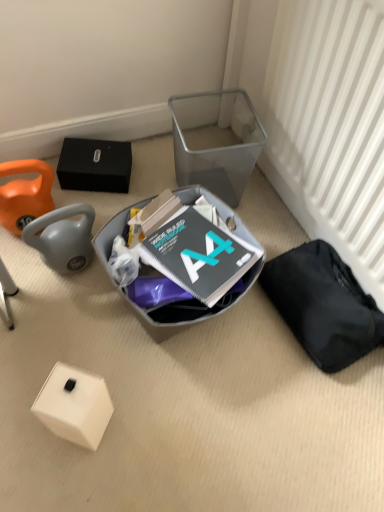
Question: From a real-world perspective, is white matte box at lower left above or below matte gray plastic bin at center, marked as the 1th waste in a left-to-right arrangement?

Choices:
 (A) below
 (B) above

Answer: (A)

Question: Considering the positions of white matte box at lower left and matte gray plastic bin at center, marked as the 1th waste in a left-to-right arrangement, in the image, is white matte box at lower left bigger or smaller than matte gray plastic bin at center, marked as the 1th waste in a left-to-right arrangement,?

Choices:
 (A) big
 (B) small

Answer: (B)

Question: Considering the real-world distances, which object is closest to the matte gray plastic bin at center, which appears as the second waste when viewed from the right?

Choices:
 (A) black fabric bag at lower right, acting as the 1th waste starting from the right
 (B) white matte box at lower left
 (C) transparent plastic shoe box at upper right
 (D) white textured radiator at right

Answer: (C)

Question: Which is farther from the black fabric bag at lower right, the 2th waste in the left-to-right sequence?

Choices:
 (A) white matte box at lower left
 (B) white textured radiator at right
 (C) transparent plastic shoe box at upper right
 (D) matte gray plastic bin at center, marked as the 1th waste in a left-to-right arrangement

Answer: (A)